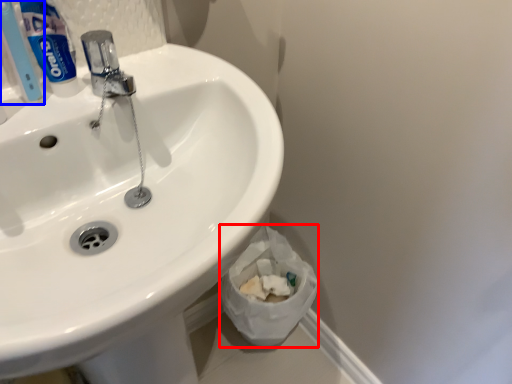
Question: Among these objects, which one is farthest to the camera, toilet paper (highlighted by a red box) or toothbrush (highlighted by a blue box)?

Choices:
 (A) toilet paper
 (B) toothbrush

Answer: (A)